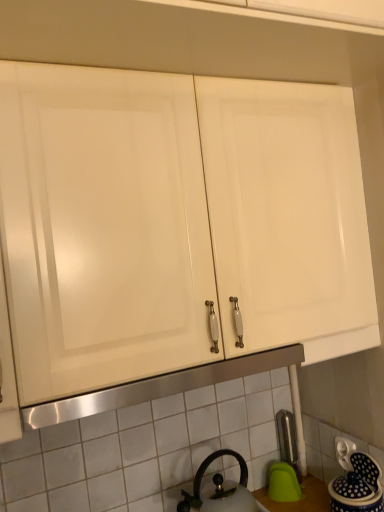
Question: Is blue glazed ceramic jar at lower right turned away from black matte kettle at lower center?

Choices:
 (A) no
 (B) yes

Answer: (A)

Question: Is blue glazed ceramic jar at lower right with black matte kettle at lower center?

Choices:
 (A) no
 (B) yes

Answer: (A)

Question: From a real-world perspective, is blue glazed ceramic jar at lower right located beneath black matte kettle at lower center?

Choices:
 (A) yes
 (B) no

Answer: (A)

Question: Could you tell me if blue glazed ceramic jar at lower right is turned towards black matte kettle at lower center?

Choices:
 (A) no
 (B) yes

Answer: (A)

Question: Can you confirm if blue glazed ceramic jar at lower right is taller than black matte kettle at lower center?

Choices:
 (A) yes
 (B) no

Answer: (B)

Question: Looking at the image, does satin nickel faucet at lower right seem bigger or smaller compared to white tile at center?

Choices:
 (A) small
 (B) big

Answer: (A)

Question: In terms of width, does satin nickel faucet at lower right look wider or thinner when compared to white tile at center?

Choices:
 (A) wide
 (B) thin

Answer: (A)

Question: From the image's perspective, is satin nickel faucet at lower right located above or below white tile at center?

Choices:
 (A) above
 (B) below

Answer: (B)

Question: From a real-world perspective, is satin nickel faucet at lower right physically located above or below white tile at center?

Choices:
 (A) below
 (B) above

Answer: (A)

Question: Is blue glazed ceramic jar at lower right to the left or to the right of white tile at center in the image?

Choices:
 (A) right
 (B) left

Answer: (A)

Question: In terms of width, does blue glazed ceramic jar at lower right look wider or thinner when compared to white tile at center?

Choices:
 (A) wide
 (B) thin

Answer: (A)

Question: In terms of size, does blue glazed ceramic jar at lower right appear bigger or smaller than white tile at center?

Choices:
 (A) small
 (B) big

Answer: (A)

Question: From their relative heights in the image, would you say blue glazed ceramic jar at lower right is taller or shorter than white tile at center?

Choices:
 (A) short
 (B) tall

Answer: (A)

Question: From the image's perspective, is white tile at center positioned above or below black matte kettle at lower center?

Choices:
 (A) above
 (B) below

Answer: (A)

Question: Is point (238, 387) positioned closer to the camera than point (221, 498)?

Choices:
 (A) closer
 (B) farther

Answer: (B)